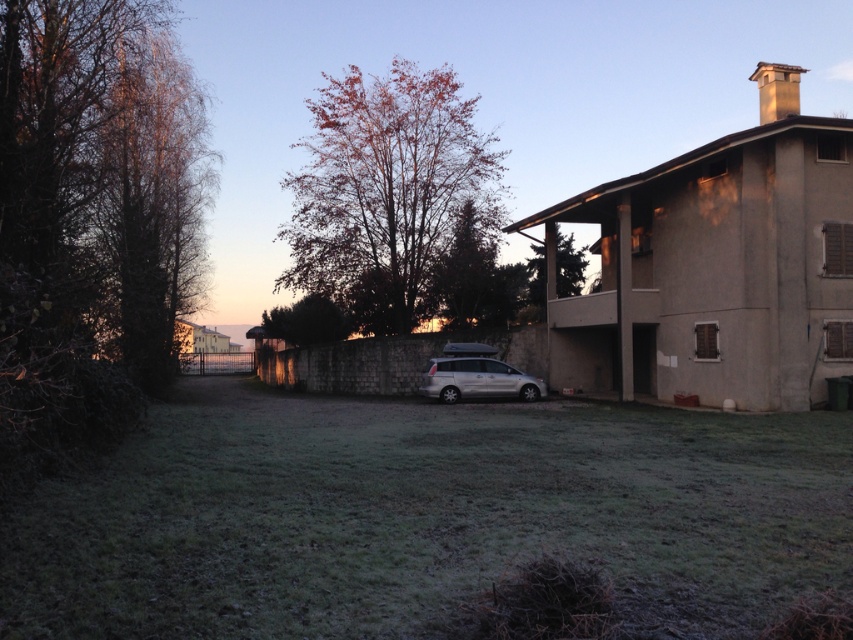
You are standing in the suburban scene and want to take a photo of the green grass at center and the green leafy tree at center. Which object should you focus on first if you want to include both in the frame without moving the camera?

You should focus on the green leafy tree at center first because it is larger than the green grass at center, ensuring it fits properly in the frame.

From the picture: Based on the scene description, where is the green grass at center located in terms of coordinates?

The green grass at center is located at coordinates point (422, 515).